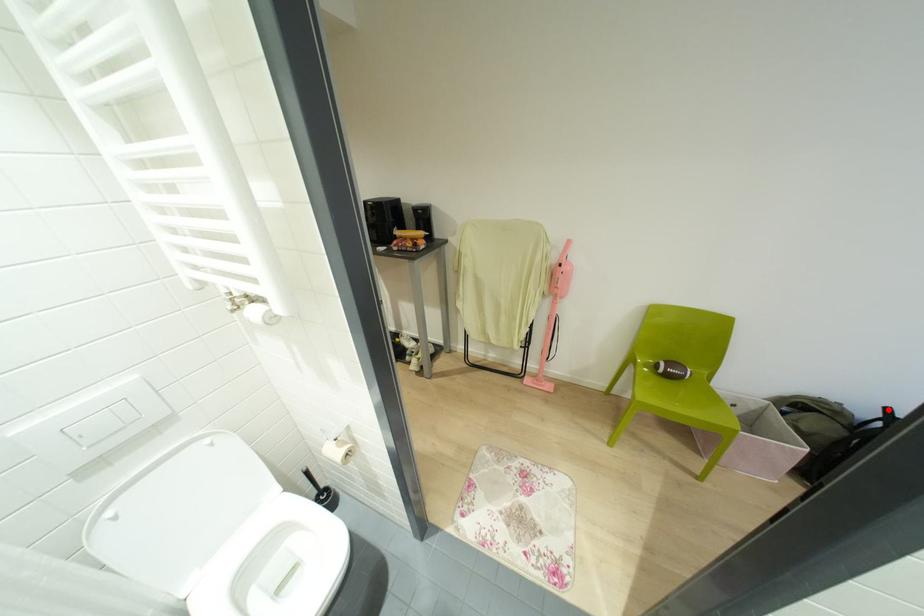
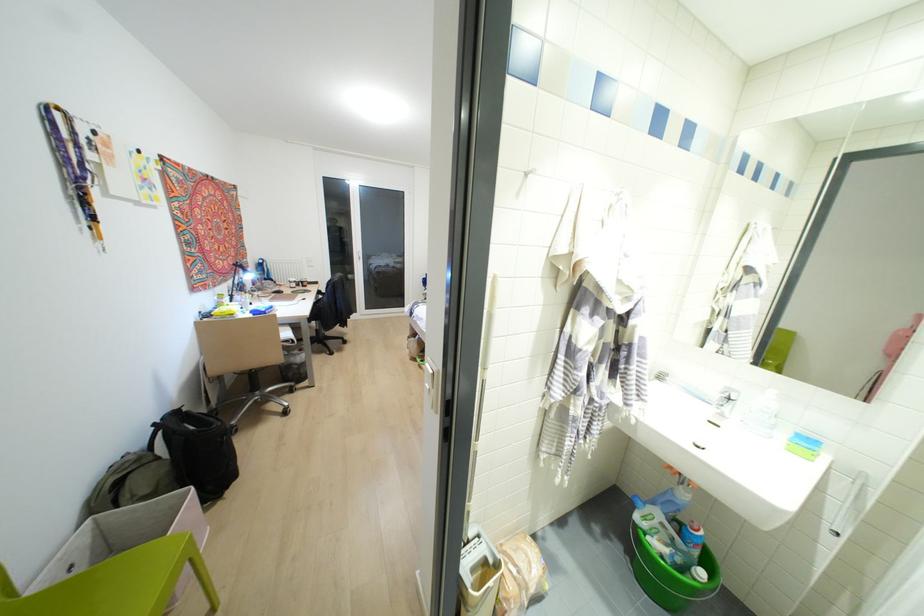
In the second image, find the point that corresponds to the highlighted location in the first image.

(153, 424)